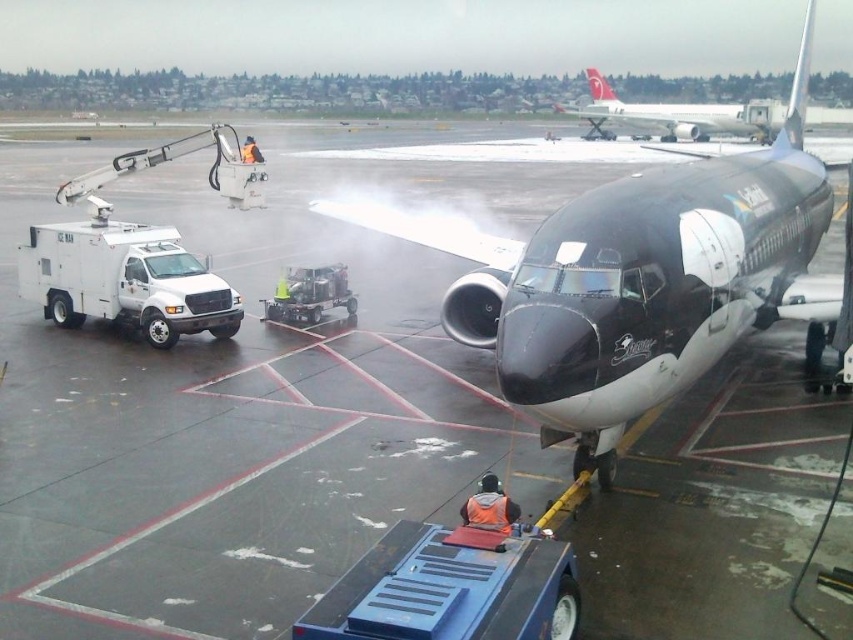
In order to click on shiny black airplane at center in this screenshot , I will do `click(639, 282)`.

Who is positioned more to the left, shiny black airplane at center or white glossy airplane at upper center?

shiny black airplane at center

Where is `shiny black airplane at center`? This screenshot has width=853, height=640. shiny black airplane at center is located at coordinates (639, 282).

Locate an element on the screen. The height and width of the screenshot is (640, 853). shiny black airplane at center is located at coordinates (639, 282).